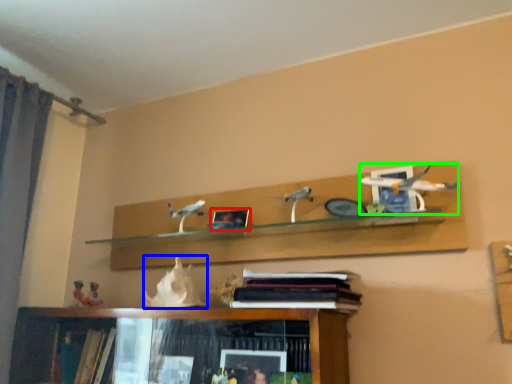
Question: Which is farther away from picture frame (highlighted by a red box)? animal (highlighted by a blue box) or toy (highlighted by a green box)?

Choices:
 (A) animal
 (B) toy

Answer: (B)